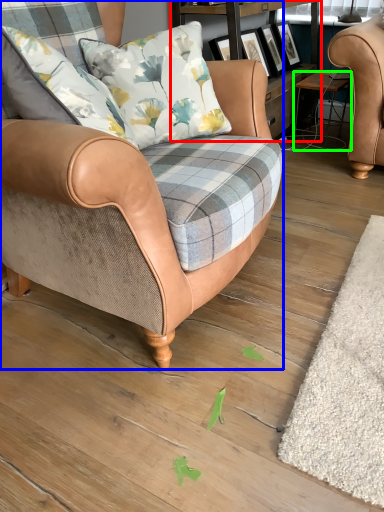
Question: Considering the real-world distances, which object is farthest from shelf (highlighted by a red box)? chair (highlighted by a blue box) or stool (highlighted by a green box)?

Choices:
 (A) chair
 (B) stool

Answer: (A)